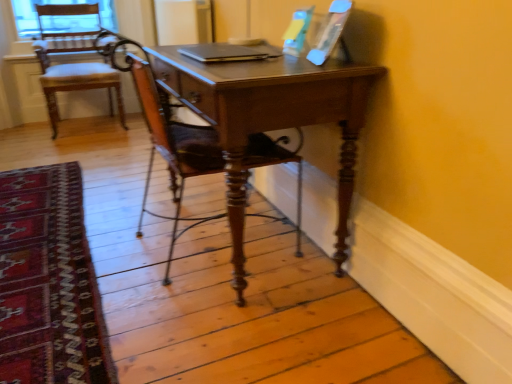
Question: Is wooden chair at left, positioned as the 2th chair in right-to-left order, not inside silver metallic laptop at center?

Choices:
 (A) yes
 (B) no

Answer: (A)

Question: From the image's perspective, does wooden chair at left, the 1th chair viewed from the left, appear lower than silver metallic laptop at center?

Choices:
 (A) no
 (B) yes

Answer: (A)

Question: Is wooden chair at left, the 1th chair viewed from the left, positioned far away from silver metallic laptop at center?

Choices:
 (A) yes
 (B) no

Answer: (A)

Question: Is silver metallic laptop at center located within wooden chair at left, the 1th chair viewed from the left?

Choices:
 (A) no
 (B) yes

Answer: (A)

Question: Considering the relative sizes of wooden chair at left, marked as the second chair in a front-to-back arrangement, and silver metallic laptop at center in the image provided, is wooden chair at left, marked as the second chair in a front-to-back arrangement, bigger than silver metallic laptop at center?

Choices:
 (A) no
 (B) yes

Answer: (B)

Question: Does wooden chair at left, the first chair from the back, appear on the right side of silver metallic laptop at center?

Choices:
 (A) yes
 (B) no

Answer: (B)

Question: Is silver metallic laptop at center touching wooden chair at left, the first chair from the back?

Choices:
 (A) yes
 (B) no

Answer: (B)

Question: Does silver metallic laptop at center have a greater width compared to wooden chair at left, marked as the second chair in a front-to-back arrangement?

Choices:
 (A) yes
 (B) no

Answer: (B)

Question: Is silver metallic laptop at center surrounding wooden chair at left, positioned as the 2th chair in right-to-left order?

Choices:
 (A) yes
 (B) no

Answer: (B)

Question: From the image's perspective, is silver metallic laptop at center located above wooden chair at left, the 1th chair viewed from the left?

Choices:
 (A) yes
 (B) no

Answer: (B)

Question: Does silver metallic laptop at center have a lesser height compared to wooden chair at left, positioned as the 2th chair in right-to-left order?

Choices:
 (A) yes
 (B) no

Answer: (A)

Question: From the image's perspective, does silver metallic laptop at center appear lower than wooden chair at left, marked as the second chair in a front-to-back arrangement?

Choices:
 (A) no
 (B) yes

Answer: (B)

Question: Can you confirm if carpet with intricate patterns at lower left is taller than wooden chair at left, marked as the second chair in a front-to-back arrangement?

Choices:
 (A) no
 (B) yes

Answer: (A)